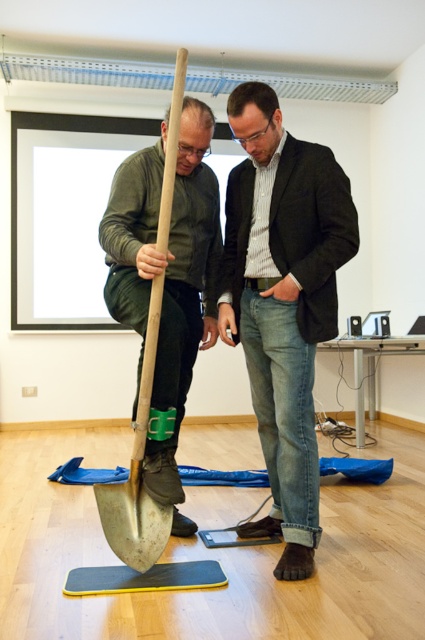
Question: Is wooden shovel at left below rubberized yellow mat at lower center?

Choices:
 (A) no
 (B) yes

Answer: (A)

Question: Which of the following is the farthest from the observer?

Choices:
 (A) (155, 524)
 (B) (180, 580)

Answer: (A)

Question: From the image, what is the correct spatial relationship of denim jeans at center in relation to rubberized yellow mat at lower center?

Choices:
 (A) above
 (B) below

Answer: (A)

Question: Based on their relative distances, which object is farther from the denim jeans at center?

Choices:
 (A) rubberized yellow mat at lower center
 (B) wooden shovel at left

Answer: (A)

Question: Does denim jeans at center appear on the right side of wooden shovel at left?

Choices:
 (A) yes
 (B) no

Answer: (A)

Question: Which is nearer to the denim jeans at center?

Choices:
 (A) wooden shovel at left
 (B) rubberized yellow mat at lower center

Answer: (A)